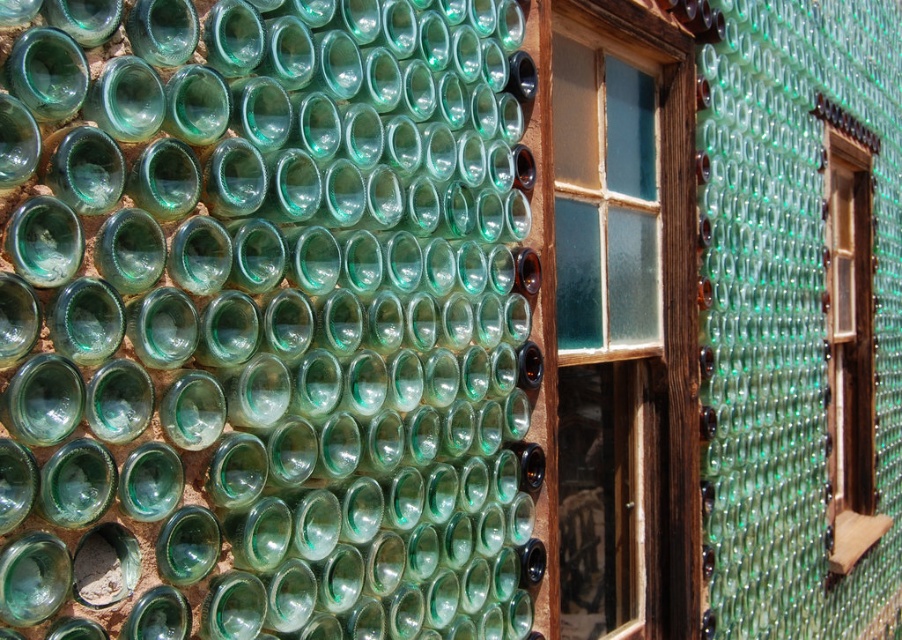
Question: Estimate the real-world distances between objects in this image. Which object is closer to the green translucent bottle at center?

Choices:
 (A) wooden frame window at right
 (B) wooden-framed window at center

Answer: (B)

Question: Considering the relative positions of wooden-framed window at center and wooden frame window at right in the image provided, where is wooden-framed window at center located with respect to wooden frame window at right?

Choices:
 (A) below
 (B) above

Answer: (A)

Question: Can you confirm if wooden-framed window at center is thinner than wooden frame window at right?

Choices:
 (A) no
 (B) yes

Answer: (B)

Question: Does green translucent bottle at center have a lesser width compared to wooden-framed window at center?

Choices:
 (A) no
 (B) yes

Answer: (A)

Question: Among these objects, which one is farthest from the camera?

Choices:
 (A) wooden frame window at right
 (B) green translucent bottle at center
 (C) wooden-framed window at center

Answer: (A)

Question: Which of these objects is positioned closest to the wooden frame window at right?

Choices:
 (A) green translucent bottle at center
 (B) wooden-framed window at center

Answer: (B)